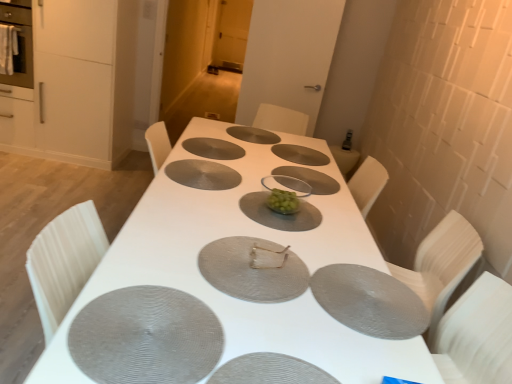
Question: From their relative heights in the image, would you say matte gray pizza pan at center, which appears as the 1th pizza pan when viewed from the front, is taller or shorter than silver textured pizza pan at center, the eighth pizza pan when ordered from front to back?

Choices:
 (A) tall
 (B) short

Answer: (A)

Question: From a real-world perspective, is matte gray pizza pan at center, which ranks as the eighth pizza pan in back-to-front order, positioned above or below silver textured pizza pan at center, the 1th pizza pan in the back-to-front sequence?

Choices:
 (A) below
 (B) above

Answer: (B)

Question: Estimate the real-world distances between objects in this image. Which object is farther from the metallic silver napkin at center?

Choices:
 (A) matte white cabinet at left
 (B) gray textured placemat at center, the 5th pizza pan in the front-to-back sequence
 (C) matte stainless steel oven at left
 (D) clear plastic plate at center
 (E) matte gray pizza pan at center, which appears as the sixth pizza pan when viewed from the front

Answer: (C)

Question: Considering the real-world distances, which object is closest to the silver textured pizza pan at center, the eighth pizza pan when ordered from front to back?

Choices:
 (A) gray textured placemat at center, placed as the 7th pizza pan when sorted from back to front
 (B) metallic silver pizza pan at center, the 4th pizza pan viewed from the front
 (C) matte stainless steel oven at left
 (D) matte white cabinet at left
 (E) matte gray pizza pan at center, acting as the 2th pizza pan starting from the back

Answer: (E)